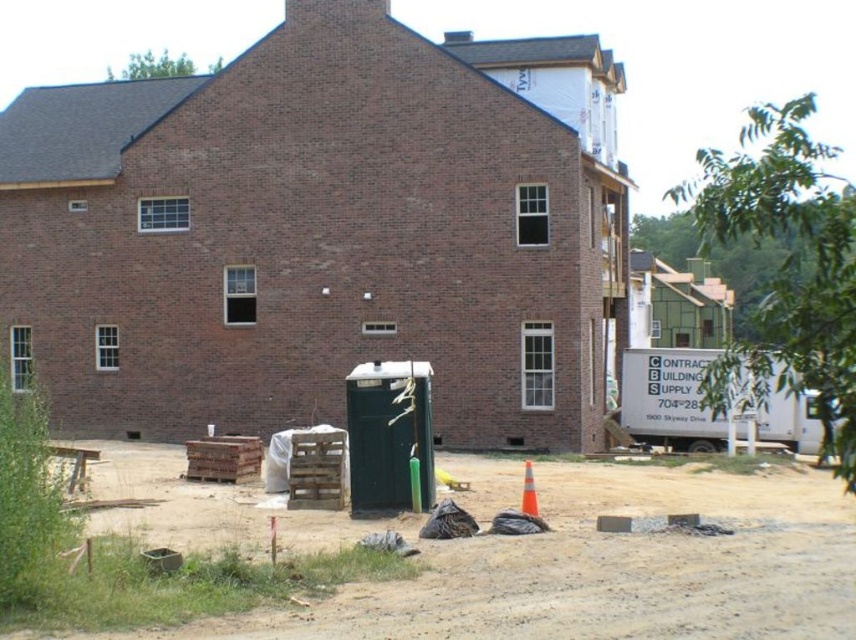
Question: Which point is farther to the camera?

Choices:
 (A) (140, 461)
 (B) (531, 465)

Answer: (A)

Question: From the image, what is the correct spatial relationship of dirt at lower center in relation to orange reflective cone at lower center?

Choices:
 (A) below
 (B) above

Answer: (A)

Question: In this image, where is dirt at lower center located relative to orange reflective cone at lower center?

Choices:
 (A) below
 (B) above

Answer: (A)

Question: Which of the following is the farthest from the observer?

Choices:
 (A) orange reflective cone at lower center
 (B) dirt at lower center

Answer: (A)

Question: Can you confirm if dirt at lower center is positioned to the right of orange reflective cone at lower center?

Choices:
 (A) no
 (B) yes

Answer: (A)